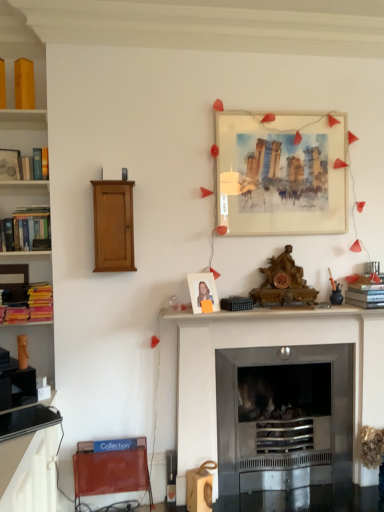
Question: Is hardcover books at left with metallic silver fireplace at center?

Choices:
 (A) yes
 (B) no

Answer: (B)

Question: Considering the relative positions of hardcover books at left and metallic silver fireplace at center in the image provided, is hardcover books at left to the left of metallic silver fireplace at center from the viewer's perspective?

Choices:
 (A) yes
 (B) no

Answer: (A)

Question: Is metallic silver fireplace at center at the back of hardcover books at left?

Choices:
 (A) no
 (B) yes

Answer: (A)

Question: Is hardcover books at left taller than metallic silver fireplace at center?

Choices:
 (A) yes
 (B) no

Answer: (B)

Question: From a real-world perspective, is hardcover books at left positioned under metallic silver fireplace at center based on gravity?

Choices:
 (A) no
 (B) yes

Answer: (A)

Question: Considering their positions, is hardcover book at right, the second book positioned from the left, located in front of or behind matte paper picture frame at upper center, the second picture frame when ordered from left to right?

Choices:
 (A) front
 (B) behind

Answer: (A)

Question: Is hardcover book at right, which is the 1th book from bottom to top, inside the boundaries of matte paper picture frame at upper center, placed as the 1th picture frame when sorted from right to left, or outside?

Choices:
 (A) inside
 (B) outside

Answer: (B)

Question: Considering the positions of point (360, 291) and point (306, 175), is point (360, 291) closer or farther from the camera than point (306, 175)?

Choices:
 (A) closer
 (B) farther

Answer: (A)

Question: Looking at their shapes, would you say hardcover book at right, placed as the 2th book when sorted from top to bottom, is wider or thinner than matte paper picture frame at upper center, which ranks as the second picture frame in bottom-to-top order?

Choices:
 (A) thin
 (B) wide

Answer: (B)

Question: Is hardcover book at right, which is the 1th book from right to left, situated inside metallic silver fireplace at center or outside?

Choices:
 (A) outside
 (B) inside

Answer: (A)

Question: In the image, is hardcover book at right, placed as the 2th book when sorted from top to bottom, on the left side or the right side of metallic silver fireplace at center?

Choices:
 (A) left
 (B) right

Answer: (B)

Question: Considering the positions of hardcover book at right, placed as the 2th book when sorted from top to bottom, and metallic silver fireplace at center in the image, is hardcover book at right, placed as the 2th book when sorted from top to bottom, bigger or smaller than metallic silver fireplace at center?

Choices:
 (A) big
 (B) small

Answer: (B)

Question: Relative to metallic silver fireplace at center, is hardcover book at right, which is the 1th book from bottom to top, in front or behind?

Choices:
 (A) front
 (B) behind

Answer: (B)

Question: Does point (205, 421) appear closer or farther from the camera than point (213, 287)?

Choices:
 (A) closer
 (B) farther

Answer: (A)

Question: Is metallic silver fireplace at center in front of or behind matte white photo frame at center, which is the 1th picture frame from left to right, in the image?

Choices:
 (A) behind
 (B) front

Answer: (A)